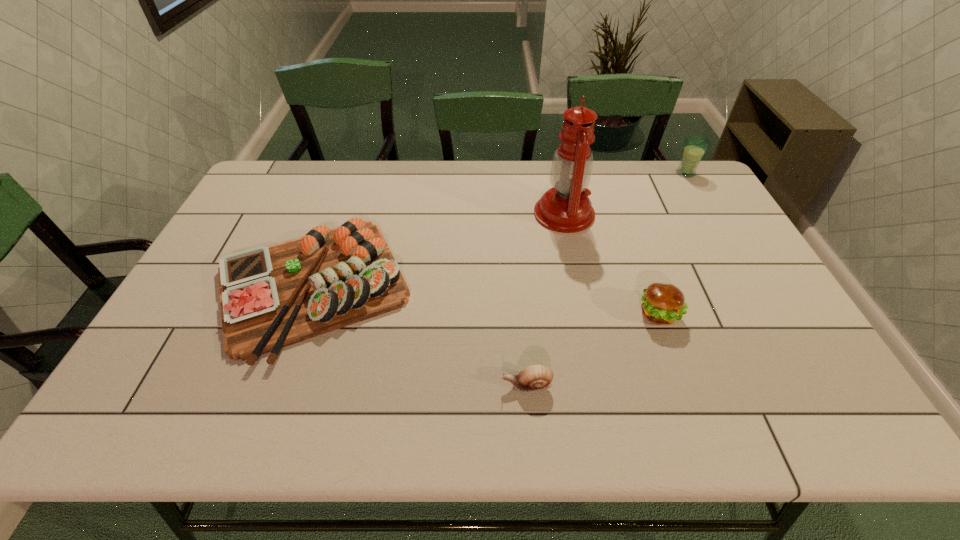
Locate an element on the screen. vacant region located on the front of the second object from right to left is located at coordinates (699, 424).

Where is `free spot located 0.180m on the right of the platter`? free spot located 0.180m on the right of the platter is located at coordinates (479, 286).

Identify the location of free space located 0.350m on the front-facing side of the shortest object. (344, 385).

Where is `vacant area situated on the front-facing side of the shortest object`? vacant area situated on the front-facing side of the shortest object is located at coordinates (461, 385).

Locate an element on the screen. This screenshot has height=540, width=960. vacant space located on the front-facing side of the shortest object is located at coordinates (352, 385).

At what (x,y) coordinates should I click in order to perform the action: click on oil lamp that is at the far edge. Please return your answer as a coordinate pair (x, y). This screenshot has height=540, width=960. Looking at the image, I should click on (566, 208).

Locate an element on the screen. This screenshot has width=960, height=540. glass present at the far edge is located at coordinates [695, 146].

Find the location of a particular element. The image size is (960, 540). object situated at the left edge is located at coordinates (271, 297).

I want to click on object present at the right edge, so click(x=695, y=146).

Locate an element on the screen. object located in the far right corner section of the desktop is located at coordinates (695, 146).